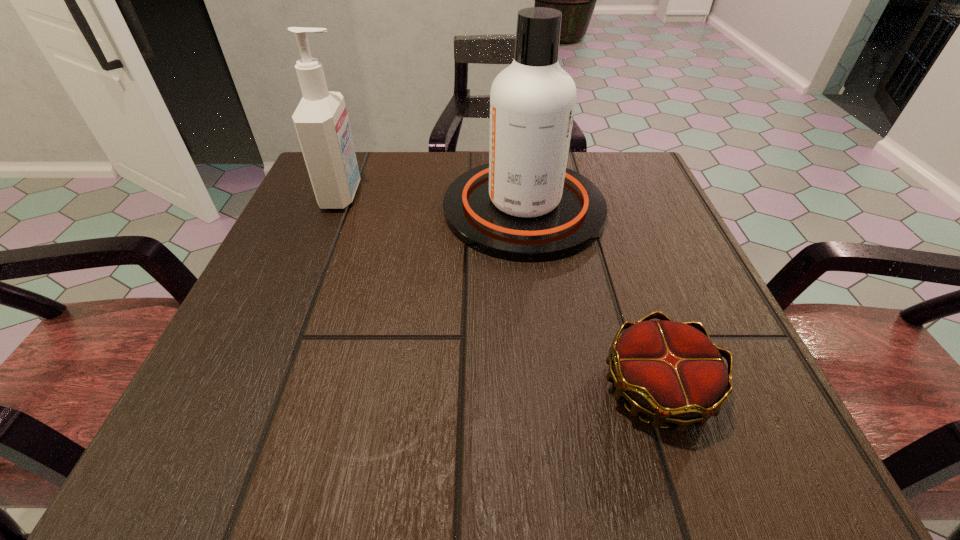
Locate an element on the screen. This screenshot has height=540, width=960. unoccupied area between the right cleansing agent and the nearest object is located at coordinates (590, 299).

This screenshot has height=540, width=960. Identify the location of vacant region between the shortest object and the leftmost object. (500, 292).

Where is `free space between the left cleansing agent and the right cleansing agent`? Image resolution: width=960 pixels, height=540 pixels. free space between the left cleansing agent and the right cleansing agent is located at coordinates (433, 202).

The image size is (960, 540). I want to click on empty space that is in between the leftmost object and the crown, so click(500, 292).

You are a GUI agent. You are given a task and a screenshot of the screen. Output one action in this format:
    pyautogui.click(x=<x>, y=<y>)
    Task: Click on the vacant space in between the left cleansing agent and the shortest object
    Image resolution: width=960 pixels, height=540 pixels.
    Given the screenshot: What is the action you would take?
    pyautogui.click(x=500, y=292)

Where is `unoccupied area between the crown and the right cleansing agent`? unoccupied area between the crown and the right cleansing agent is located at coordinates (590, 299).

You are a GUI agent. You are given a task and a screenshot of the screen. Output one action in this format:
    pyautogui.click(x=<x>, y=<y>)
    Task: Click on the free point between the nearest object and the left cleansing agent
    This screenshot has width=960, height=540.
    Given the screenshot: What is the action you would take?
    pyautogui.click(x=500, y=292)

Locate an element on the screen. Image resolution: width=960 pixels, height=540 pixels. free area in between the leftmost object and the shortest object is located at coordinates (500, 292).

Find the location of `unoccupied position between the left cleansing agent and the crown`. unoccupied position between the left cleansing agent and the crown is located at coordinates (500, 292).

Find the location of a particular element. This screenshot has width=960, height=540. object that stands as the closest to the right cleansing agent is located at coordinates (321, 122).